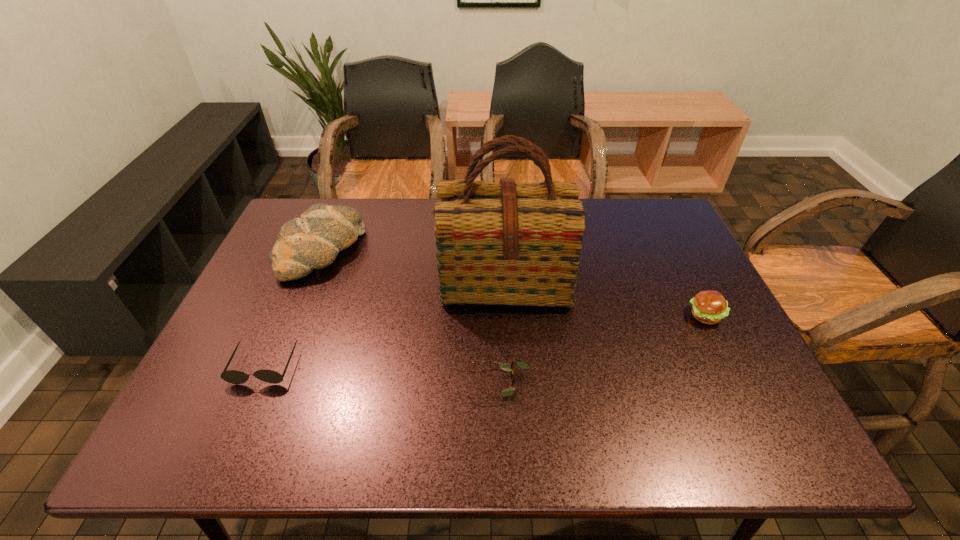
At what (x,y) coordinates should I click in order to perform the action: click on shopping bag. Please return your answer as a coordinate pair (x, y). This screenshot has width=960, height=540. Looking at the image, I should click on (498, 243).

Where is `the second tallest object`? the second tallest object is located at coordinates (313, 241).

Locate an element on the screen. This screenshot has height=540, width=960. hamburger is located at coordinates (709, 307).

Find the location of a particular element. This screenshot has width=960, height=540. the third tallest object is located at coordinates (709, 307).

This screenshot has height=540, width=960. Find the location of `sunglasses`. sunglasses is located at coordinates (236, 377).

The image size is (960, 540). I want to click on the shortest object, so click(509, 367).

This screenshot has width=960, height=540. Find the location of `vacant space located 0.130m on the open handle side of the tallest object`. vacant space located 0.130m on the open handle side of the tallest object is located at coordinates (509, 357).

This screenshot has width=960, height=540. Identify the location of free spot located 0.060m on the front of the second tallest object. (300, 302).

The image size is (960, 540). What are the coordinates of `vacant space located on the back of the third shortest object` in the screenshot? It's located at (684, 272).

Identify the location of vacant space located 0.270m on the front-facing side of the spectacles. (345, 383).